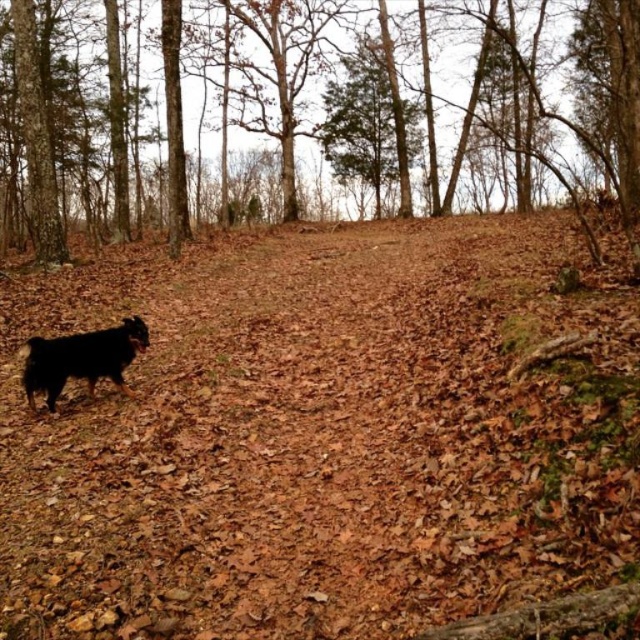
Is brown bark tree at left taller than shaggy brown dog at lower left?

Yes.

How distant is brown bark tree at left from shaggy brown dog at lower left?

16.05 meters

Image resolution: width=640 pixels, height=640 pixels. Describe the element at coordinates (316, 113) in the screenshot. I see `brown bark tree at left` at that location.

In order to click on brown bark tree at left in this screenshot , I will do `click(316, 113)`.